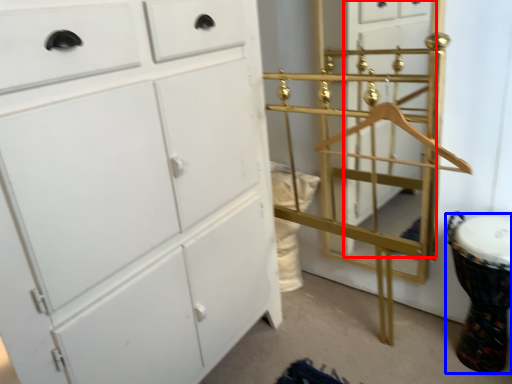
Question: Which object appears farthest to the camera in this image, glass door (highlighted by a red box) or drum (highlighted by a blue box)?

Choices:
 (A) glass door
 (B) drum

Answer: (A)